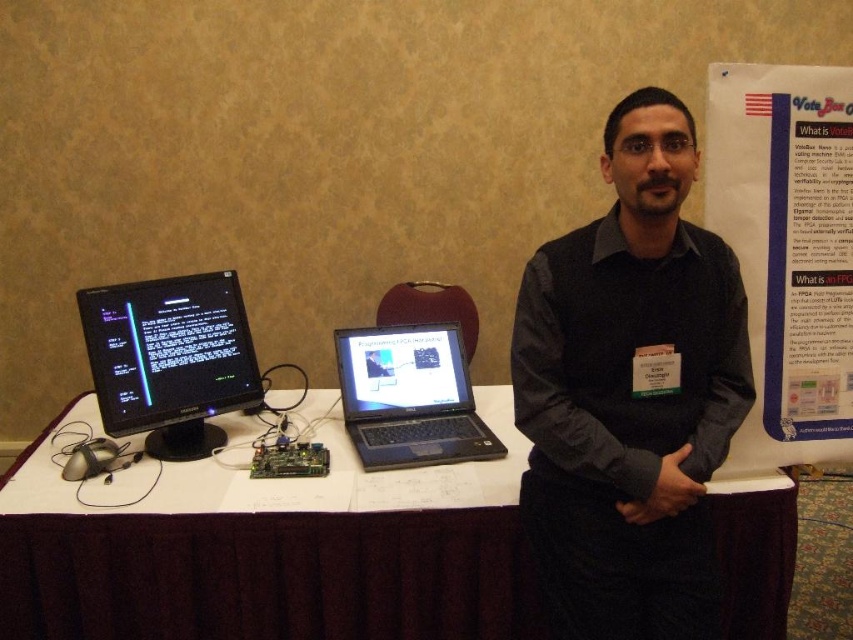
You are organizing an event and need to place a new decorative item on the table. The item is 12 inches wide. Can the white tablecloth at center accommodate this item without overlapping the black glossy monitor at left?

The white tablecloth at center might be wider than the black glossy monitor at left, so there is a possibility that the item can be placed without overlapping. However, since the exact width difference isn not specified, it is recommended to check the available space before placing the item.

You are an attendee at the presentation and need to see both the white paper at upper right and the black glossy monitor at left. Which one is located above the other?

The white paper at upper right is positioned over the black glossy monitor at left, meaning it is above the monitor.

You are attending a tech conference and notice a presenter with a black glossy monitor at left and a black glossy laptop at center on the table. Which device has a bigger screen?

The black glossy monitor at left has a larger screen than the black glossy laptop at center.